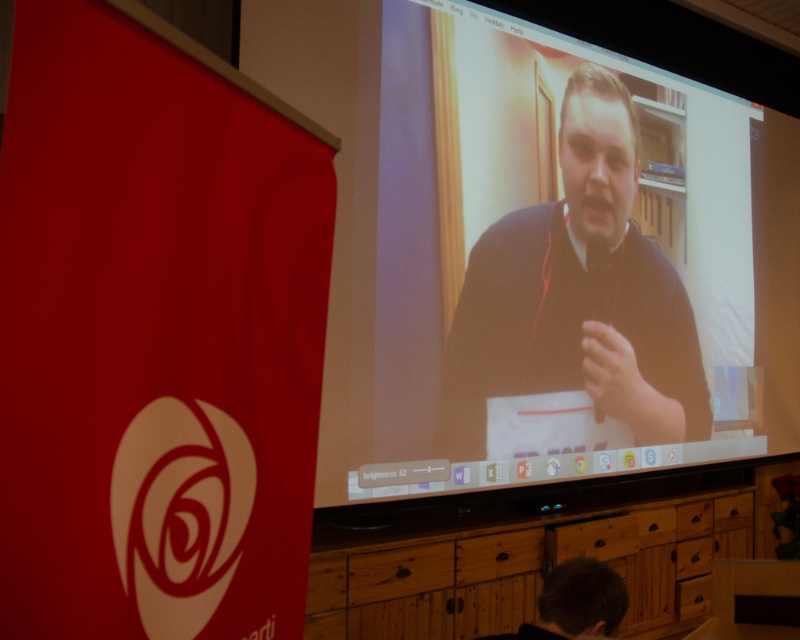
Can you confirm if matte black laptop at upper center is bigger than dark brown hair at lower center?

Indeed, matte black laptop at upper center has a larger size compared to dark brown hair at lower center.

Who is higher up, matte black laptop at upper center or dark brown hair at lower center?

Positioned higher is matte black laptop at upper center.

Between point (392, 301) and point (594, 573), which one is positioned behind?

Point (392, 301)

Locate an element on the screen. matte black laptop at upper center is located at coordinates (578, 237).

You are a GUI agent. You are given a task and a screenshot of the screen. Output one action in this format:
    pyautogui.click(x=<x>, y=<y>)
    Task: Click on the wooden at center
    
    Given the screenshot: What is the action you would take?
    (x=536, y=556)

Who is positioned more to the left, wooden at center or dark brown hair at lower center?

dark brown hair at lower center is more to the left.

Is point (606, 502) closer to viewer compared to point (580, 609)?

No.

You are a GUI agent. You are given a task and a screenshot of the screen. Output one action in this format:
    pyautogui.click(x=<x>, y=<y>)
    Task: Click on the wooden at center
    
    Given the screenshot: What is the action you would take?
    pyautogui.click(x=536, y=556)

Can you confirm if dark brown sweater at center is positioned to the left of wooden at center?

Correct, you'll find dark brown sweater at center to the left of wooden at center.

Is point (674, 426) closer to viewer compared to point (505, 508)?

No, it is not.

What do you see at coordinates (576, 296) in the screenshot?
I see `dark brown sweater at center` at bounding box center [576, 296].

Locate an element on the screen. The image size is (800, 640). dark brown sweater at center is located at coordinates (576, 296).